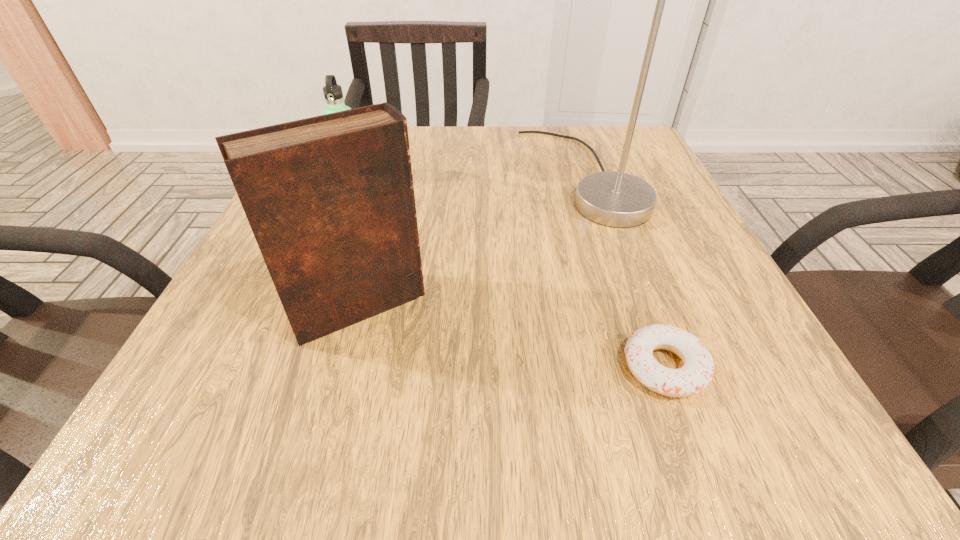
Find the location of a particular element. vacant area that lies between the doughnut and the Bible is located at coordinates (512, 336).

Identify the location of unoccupied area between the third shortest object and the doughnut. (512, 336).

Identify the location of object that can be found as the second closest to the doughnut. The width and height of the screenshot is (960, 540). (330, 200).

The height and width of the screenshot is (540, 960). Identify the location of object that is the closest one to the table lamp. (330, 200).

Find the location of a particular element. vacant area that satisfies the following two spatial constraints: 1. on the front side of the Bible; 2. on the left side of the third tallest object is located at coordinates (297, 306).

Where is `free space that satisfies the following two spatial constraints: 1. on the front side of the table lamp; 2. on the left side of the shortest object`? The image size is (960, 540). free space that satisfies the following two spatial constraints: 1. on the front side of the table lamp; 2. on the left side of the shortest object is located at coordinates (650, 367).